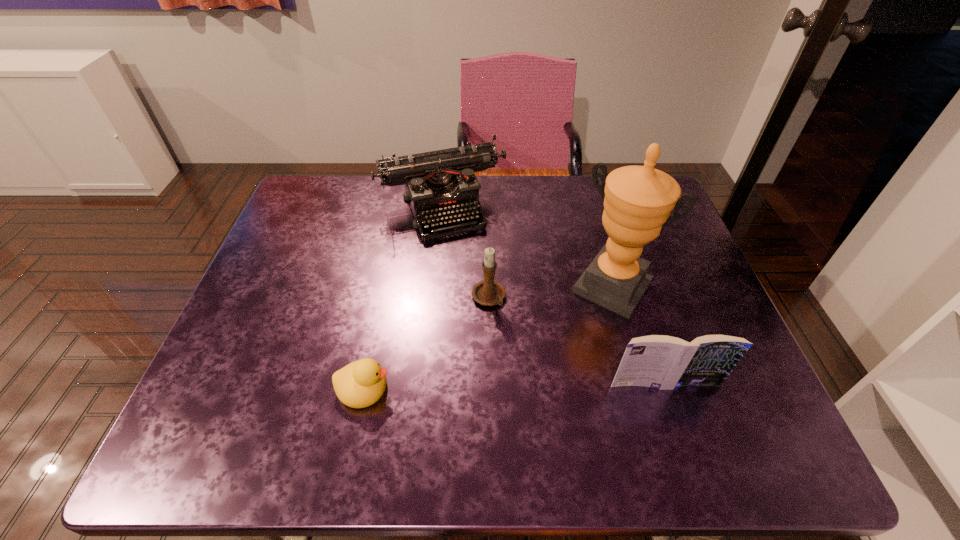
Find the location of a particular element. duckling is located at coordinates (360, 384).

What are the coordinates of `book` in the screenshot? It's located at (664, 362).

Where is `the tallest object`? the tallest object is located at coordinates (638, 200).

Locate an element on the screen. The width and height of the screenshot is (960, 540). typewriter is located at coordinates (438, 184).

Identify the location of candle holder. The height and width of the screenshot is (540, 960). (489, 292).

The width and height of the screenshot is (960, 540). I want to click on blank space located on the face of the duckling, so click(x=425, y=388).

The width and height of the screenshot is (960, 540). I want to click on vacant space situated 0.290m at the front of the tallest object with handles, so (x=532, y=406).

I want to click on vacant space located at the front of the tallest object with handles, so point(554,374).

Image resolution: width=960 pixels, height=540 pixels. What are the coordinates of `vacant space situated 0.220m at the front of the tallest object with handles` in the screenshot? It's located at (549, 381).

The height and width of the screenshot is (540, 960). In order to click on free space located on the keyboard of the farthest object in this screenshot , I will do `click(474, 268)`.